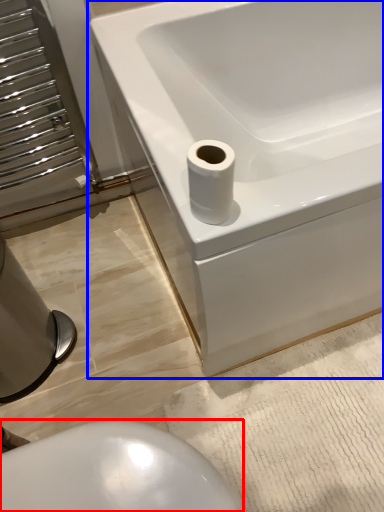
Question: Which of the following is the farthest to the observer, bidet (highlighted by a red box) or bathtub (highlighted by a blue box)?

Choices:
 (A) bidet
 (B) bathtub

Answer: (B)